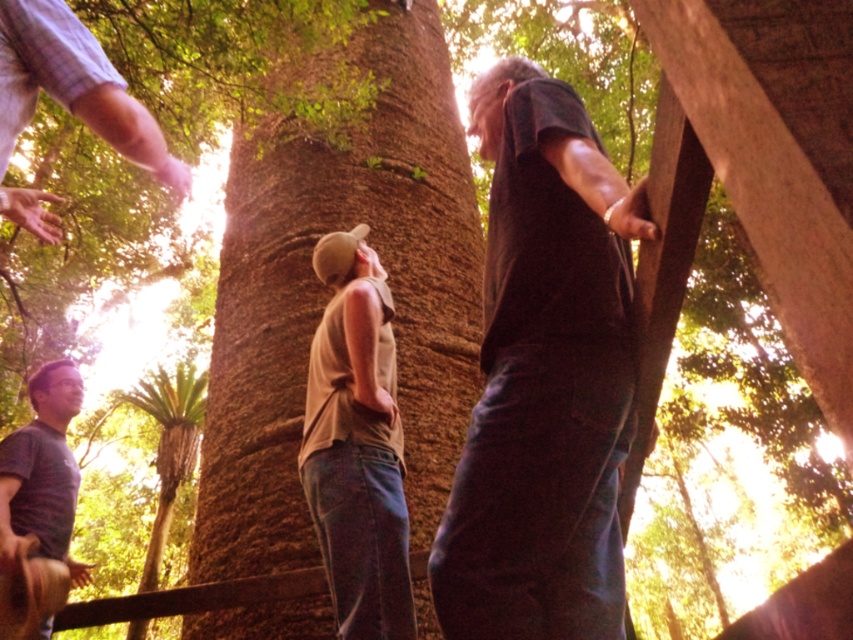
Is point (402, 180) positioned before point (309, 396)?

No, it is behind (309, 396).

Can you confirm if brown rough bark at center is smaller than tan fabric shirt at center?

No, brown rough bark at center is not smaller than tan fabric shirt at center.

Is point (242, 129) behind point (357, 406)?

That is True.

What are the coordinates of `brown rough bark at center` in the screenshot? It's located at (329, 292).

In the scene shown: Who is higher up, tan fabric shirt at center or striped cotton shirt at lower left?

tan fabric shirt at center

Does tan fabric shirt at center have a greater width compared to striped cotton shirt at lower left?

Yes, tan fabric shirt at center is wider than striped cotton shirt at lower left.

Between point (364, 387) and point (68, 372), which one is positioned behind?

Point (68, 372)

Where is `tan fabric shirt at center`? This screenshot has width=853, height=640. tan fabric shirt at center is located at coordinates (357, 445).

This screenshot has height=640, width=853. Find the location of `brown rough bark at center`. brown rough bark at center is located at coordinates (329, 292).

Can you confirm if brown rough bark at center is positioned to the right of striped cotton shirt at lower left?

Indeed, brown rough bark at center is positioned on the right side of striped cotton shirt at lower left.

Is point (444, 273) closer to viewer compared to point (6, 536)?

That is False.

You are a GUI agent. You are given a task and a screenshot of the screen. Output one action in this format:
    pyautogui.click(x=<x>, y=<y>)
    Task: Click on the brown rough bark at center
    This screenshot has width=853, height=640.
    Given the screenshot: What is the action you would take?
    pyautogui.click(x=329, y=292)